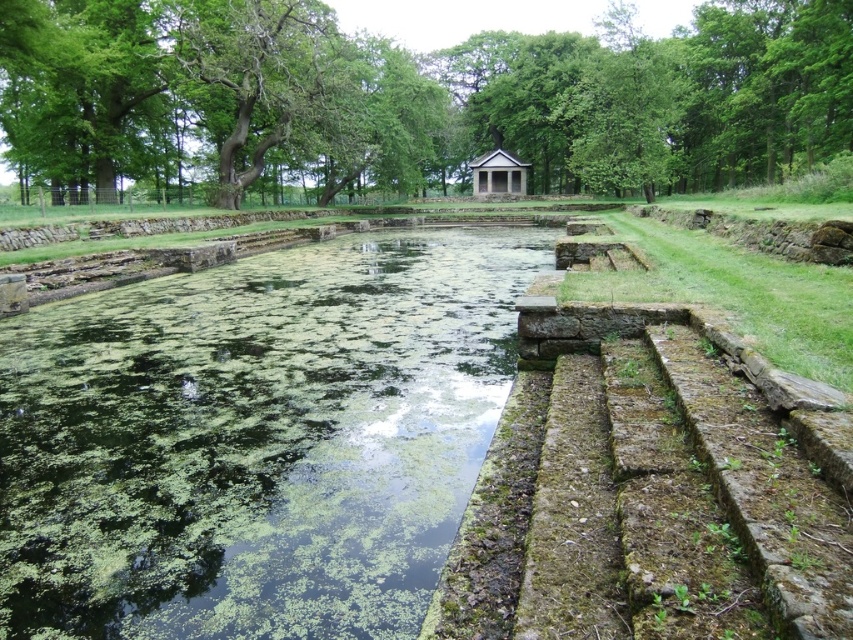
Between point (67, 392) and point (479, 184), which one is positioned behind?

Positioned behind is point (479, 184).

Identify the location of green algae-covered water at center. The height and width of the screenshot is (640, 853). click(254, 438).